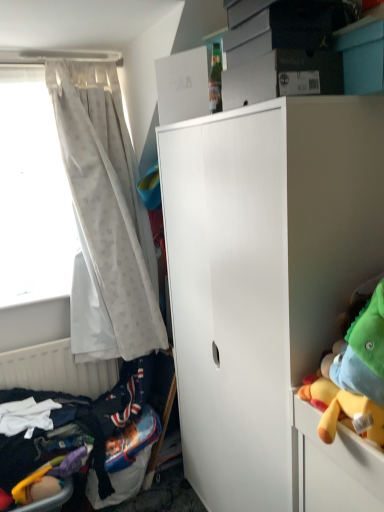
The width and height of the screenshot is (384, 512). What do you see at coordinates (108, 201) in the screenshot?
I see `white sheer curtain at left` at bounding box center [108, 201].

Locate an element on the screen. This screenshot has width=384, height=512. white matte cabinet at center is located at coordinates (263, 276).

Identify the location of dark blue fabric bed at lower left. The width and height of the screenshot is (384, 512). (77, 424).

This screenshot has width=384, height=512. In order to click on white sheer curtain at left in this screenshot , I will do `click(108, 201)`.

Is white matte cabinet at center facing away from dark blue fabric bed at lower left?

No, white matte cabinet at center's orientation is not away from dark blue fabric bed at lower left.

Who is more distant, white matte cabinet at center or dark blue fabric bed at lower left?

dark blue fabric bed at lower left is more distant.

From the picture: From a real-world perspective, who is located lower, white matte cabinet at center or dark blue fabric bed at lower left?

dark blue fabric bed at lower left, from a real-world perspective.

Which is correct: white matte cabinet at center is inside dark blue fabric bed at lower left, or outside of it?

The correct answer is: outside.

At what (x,y) coordinates should I click in order to perform the action: click on curtain that appears on the right of white matte radiator at lower left. Please return your answer as a coordinate pair (x, y). The height and width of the screenshot is (512, 384). Looking at the image, I should click on (108, 201).

Considering the relative sizes of white matte radiator at lower left and white sheer curtain at left in the image provided, is white matte radiator at lower left thinner than white sheer curtain at left?

Correct, the width of white matte radiator at lower left is less than that of white sheer curtain at left.

Can you confirm if white matte radiator at lower left is shorter than white sheer curtain at left?

Yes, white matte radiator at lower left is shorter than white sheer curtain at left.

From a real-world perspective, which is physically above, white matte radiator at lower left or white sheer curtain at left?

white sheer curtain at left, from a real-world perspective.

From a real-world perspective, who is located higher, dark blue fabric bed at lower left or white matte radiator at lower left?

white matte radiator at lower left, from a real-world perspective.

Is dark blue fabric bed at lower left not near white matte radiator at lower left?

That's not correct — dark blue fabric bed at lower left is a little close to white matte radiator at lower left.

Considering the relative sizes of dark blue fabric bed at lower left and white matte radiator at lower left in the image provided, is dark blue fabric bed at lower left shorter than white matte radiator at lower left?

Correct, dark blue fabric bed at lower left is not as tall as white matte radiator at lower left.

Looking at this image, which is more to the left, dark blue fabric bed at lower left or white matte radiator at lower left?

Positioned to the left is white matte radiator at lower left.

Considering the relative positions of white sheer curtain at left and dark blue fabric bed at lower left in the image provided, is white sheer curtain at left behind dark blue fabric bed at lower left?

Yes, white sheer curtain at left is further from the viewer.

Is white sheer curtain at left aimed at dark blue fabric bed at lower left?

No, white sheer curtain at left does not turn towards dark blue fabric bed at lower left.

Based on their positions, is white sheer curtain at left located to the left or right of dark blue fabric bed at lower left?

In the image, white sheer curtain at left appears on the left side of dark blue fabric bed at lower left.

Is point (132, 238) positioned after point (128, 377)?

No, it is not.

Can we say white matte cabinet at center lies outside white sheer curtain at left?

That's correct, white matte cabinet at center is outside of white sheer curtain at left.

Can you confirm if white matte cabinet at center is smaller than white sheer curtain at left?

Incorrect, white matte cabinet at center is not smaller in size than white sheer curtain at left.

From a real-world perspective, which object stands above the other?

From a 3D spatial view, white sheer curtain at left is above.

Is dark blue fabric bed at lower left thinner than white matte cabinet at center?

Yes, dark blue fabric bed at lower left is thinner than white matte cabinet at center.

Can you confirm if dark blue fabric bed at lower left is shorter than white matte cabinet at center?

Indeed, dark blue fabric bed at lower left has a lesser height compared to white matte cabinet at center.

In the scene shown: Who is smaller, dark blue fabric bed at lower left or white matte cabinet at center?

With smaller size is dark blue fabric bed at lower left.

Between dark blue fabric bed at lower left and white matte cabinet at center, which one is positioned behind?

Positioned behind is dark blue fabric bed at lower left.

Considering the relative sizes of dark blue fabric bed at lower left and white sheer curtain at left in the image provided, is dark blue fabric bed at lower left smaller than white sheer curtain at left?

Actually, dark blue fabric bed at lower left might be larger than white sheer curtain at left.

Between dark blue fabric bed at lower left and white sheer curtain at left, which one has more height?

With more height is white sheer curtain at left.

Is dark blue fabric bed at lower left next to white sheer curtain at left and touching it?

No.

Based on the photo, between dark blue fabric bed at lower left and white sheer curtain at left, which one has larger width?

dark blue fabric bed at lower left is wider.

The image size is (384, 512). Find the location of `bed below the white matte cabinet at center (from the image's perspective)`. bed below the white matte cabinet at center (from the image's perspective) is located at coordinates [x=77, y=424].

Locate an element on the screen. This screenshot has width=384, height=512. curtain in front of the white matte radiator at lower left is located at coordinates (108, 201).

From the image, which object appears to be farther from dark blue fabric bed at lower left, white sheer curtain at left or white matte radiator at lower left?

Among the two, white sheer curtain at left is located further to dark blue fabric bed at lower left.

Looking at the image, which one is located closer to white sheer curtain at left, white sheer curtain at left or white matte cabinet at center?

white sheer curtain at left lies closer to white sheer curtain at left than the other object.

Estimate the real-world distances between objects in this image. Which object is further from dark blue fabric bed at lower left, white matte cabinet at center or white sheer curtain at left?

white matte cabinet at center lies further to dark blue fabric bed at lower left than the other object.

When comparing their distances from white matte cabinet at center, does white matte radiator at lower left or dark blue fabric bed at lower left seem closer?

dark blue fabric bed at lower left lies closer to white matte cabinet at center than the other object.

When comparing their distances from white matte radiator at lower left, does white sheer curtain at left or dark blue fabric bed at lower left seem closer?

Based on the image, dark blue fabric bed at lower left appears to be nearer to white matte radiator at lower left.

Which object lies nearer to the anchor point white sheer curtain at left, white sheer curtain at left or white matte cabinet at center?

white sheer curtain at left is closer to white sheer curtain at left.

From the picture: Which object lies further to the anchor point white matte radiator at lower left, dark blue fabric bed at lower left or white sheer curtain at left?

white sheer curtain at left lies further to white matte radiator at lower left than the other object.

From the image, which object appears to be farther from white sheer curtain at left, white matte radiator at lower left or white matte cabinet at center?

Among the two, white matte cabinet at center is located further to white sheer curtain at left.

Identify the location of curtain situated between white sheer curtain at left and white matte cabinet at center from left to right. This screenshot has width=384, height=512. (108, 201).

Find the location of `bed situated between white matte radiator at lower left and white matte cabinet at center from left to right`. bed situated between white matte radiator at lower left and white matte cabinet at center from left to right is located at coordinates (77, 424).

Locate an element on the screen. Image resolution: width=384 pixels, height=512 pixels. radiator between white sheer curtain at left and dark blue fabric bed at lower left in the vertical direction is located at coordinates (56, 370).

Where is `curtain between white matte radiator at lower left and white matte cabinet at center from left to right`? The height and width of the screenshot is (512, 384). curtain between white matte radiator at lower left and white matte cabinet at center from left to right is located at coordinates (108, 201).